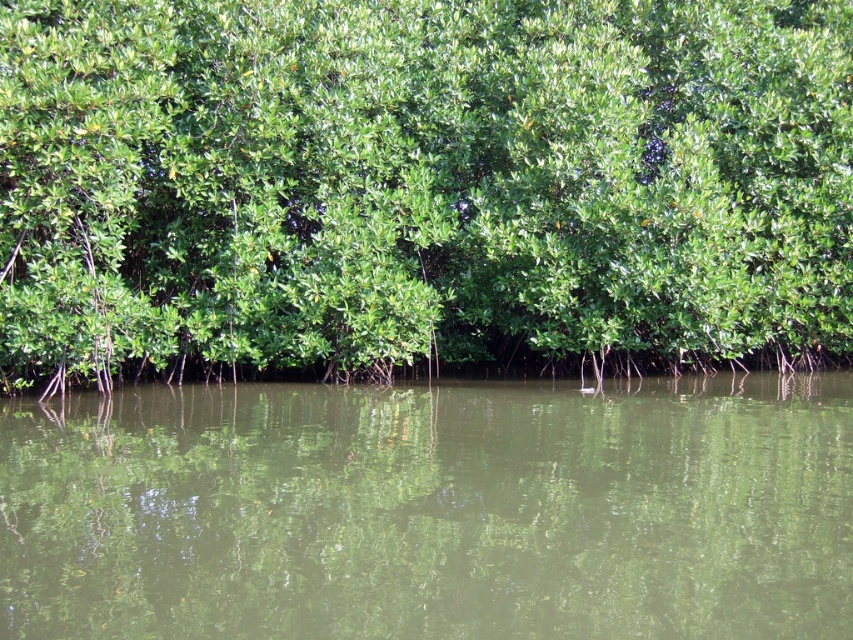
Can you confirm if green leafy tree at center is bigger than green reflective water at center?

Indeed, green leafy tree at center has a larger size compared to green reflective water at center.

Measure the distance from green leafy tree at center to green reflective water at center.

3.65 meters

Which is in front, point (724, 141) or point (154, 618)?

Point (154, 618)

Image resolution: width=853 pixels, height=640 pixels. What are the coordinates of `green leafy tree at center` in the screenshot? It's located at (421, 188).